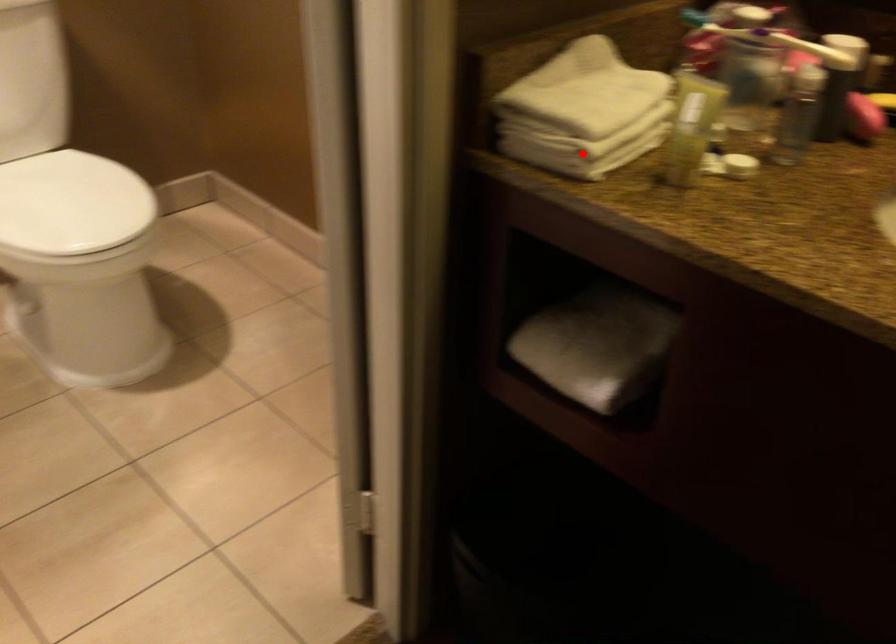
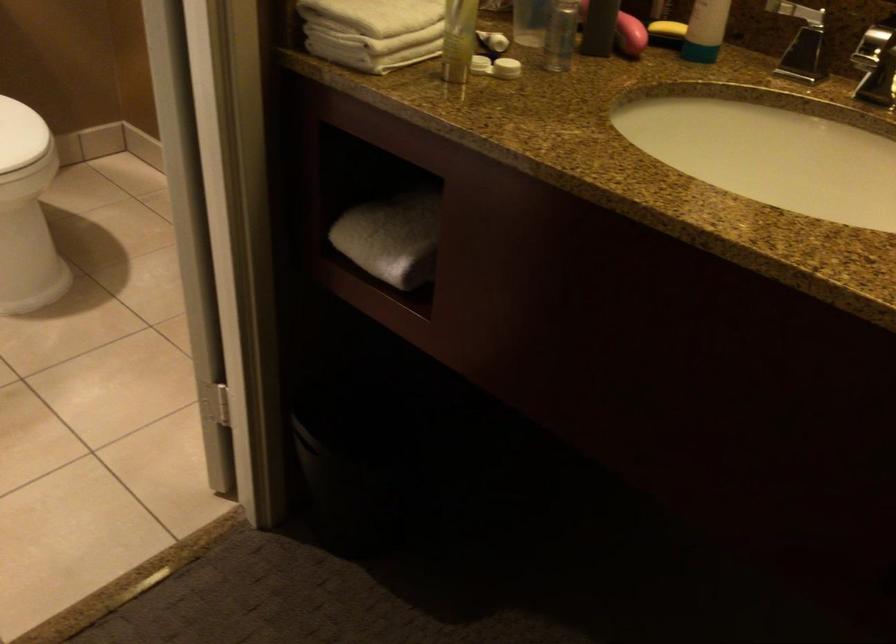
Where in the second image is the point corresponding to the highlighted location from the first image?

(366, 51)